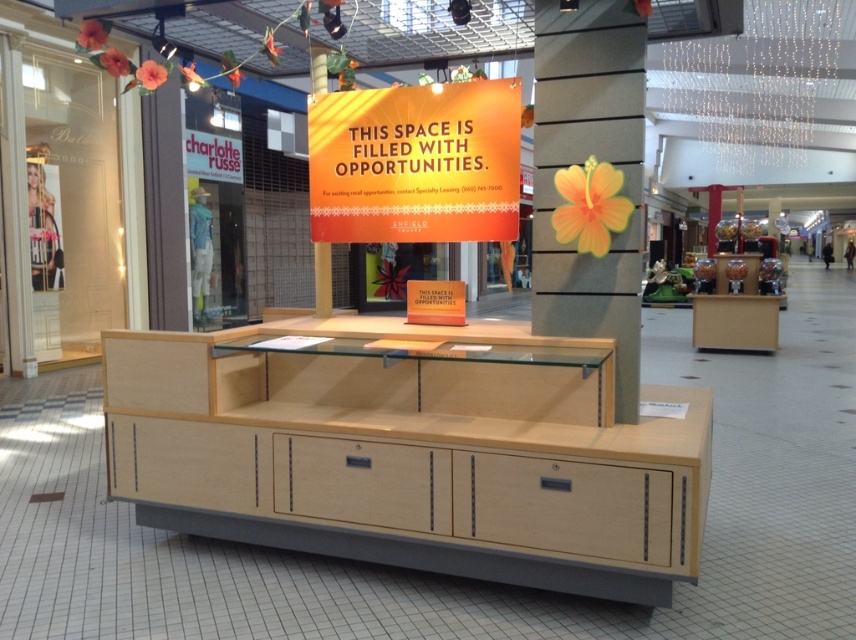
Consider the image. You are a delivery person trying to place a large box on the light wood cabinet at center. However, there is a light wood drawer at center in the way. Can you move the drawer to make space?

The light wood cabinet at center is in front of the light wood drawer at center, meaning the drawer is behind the cabinet. Since the cabinet is blocking access to the drawer, you cannot move the drawer to make space.

You are a delivery person who needs to place a large package on the light wood cabinet at center or the light wood drawer at center. Based on their sizes, which one can hold the package?

The light wood cabinet at center has a larger size compared to the light wood drawer at center, so the large package can be placed on the light wood cabinet at center.

You are a store manager who needs to place a new promotional banner that is 3 meters wide. You have two options for placement locations based on the image. The first option is above the light wood cabinet at center, and the second option is above the orange matte sign at center. Which location would allow the banner to fit without needing to be trimmed?

The light wood cabinet at center is larger in size than the orange matte sign at center, so placing the 3 meters wide banner above the light wood cabinet at center would provide enough space without trimming.